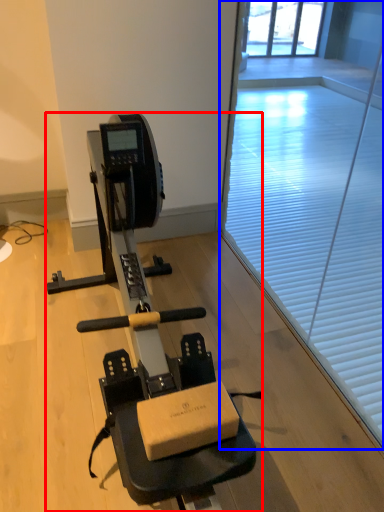
Question: Which object is further to the camera taking this photo, stationary bicycle (highlighted by a red box) or window screen (highlighted by a blue box)?

Choices:
 (A) stationary bicycle
 (B) window screen

Answer: (B)